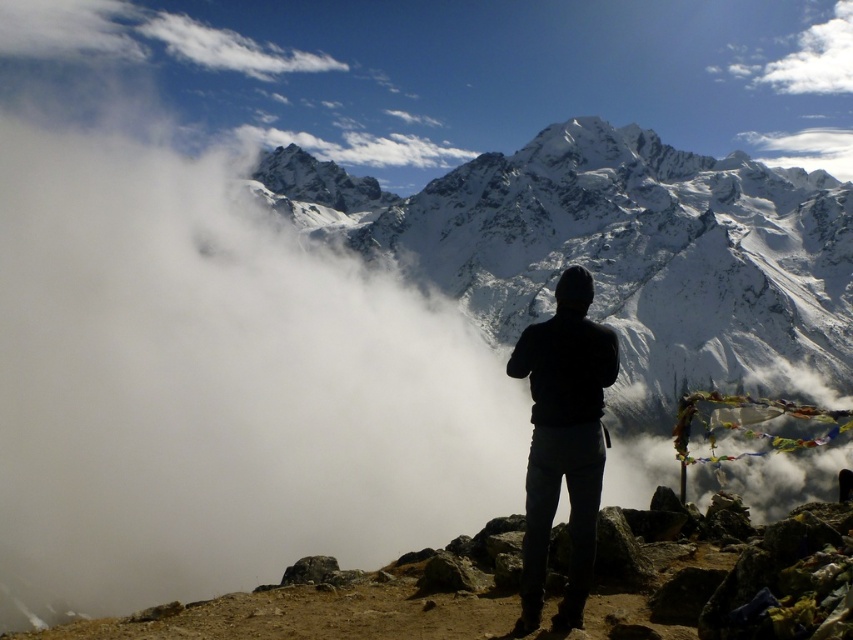
Based on the photo, does black matte jacket at center appear over white fluffy cloud at upper right?

Incorrect, black matte jacket at center is not positioned above white fluffy cloud at upper right.

Is black matte jacket at center taller than white fluffy cloud at upper right?

Correct, black matte jacket at center is much taller as white fluffy cloud at upper right.

I want to click on black matte jacket at center, so click(x=563, y=442).

Find the location of a particular element. black matte jacket at center is located at coordinates (563, 442).

Can you confirm if snowy granite mountain at upper center is bigger than black matte jacket at center?

Yes.

Is point (480, 259) more distant than point (595, 410)?

That is True.

Is point (483, 284) less distant than point (531, 556)?

No.

The height and width of the screenshot is (640, 853). I want to click on snowy granite mountain at upper center, so click(x=618, y=253).

Which is below, snowy granite mountain at upper center or white fluffy cloud at upper right?

Positioned lower is snowy granite mountain at upper center.

Does snowy granite mountain at upper center appear under white fluffy cloud at upper right?

Yes.

Does point (665, 282) come in front of point (801, 88)?

Yes, it is.

Locate an element on the screen. snowy granite mountain at upper center is located at coordinates (618, 253).